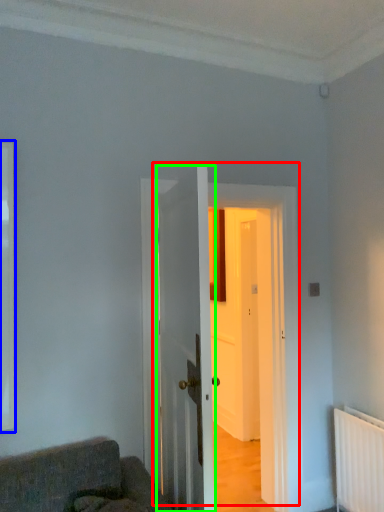
Question: Based on their relative distances, which object is farther from door (highlighted by a red box)? Choose from window (highlighted by a blue box) and door (highlighted by a green box).

Choices:
 (A) window
 (B) door

Answer: (A)